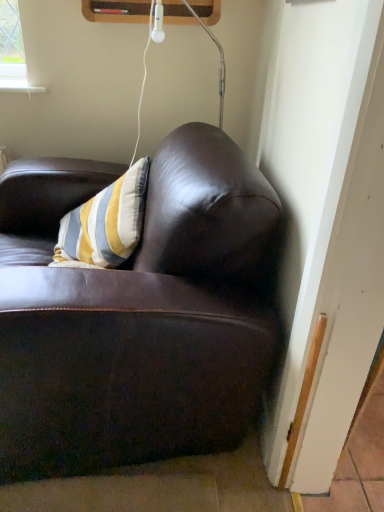
Question: From a real-world perspective, does shiny brown leather couch at upper right sit lower than matte white lamp at upper center?

Choices:
 (A) no
 (B) yes

Answer: (B)

Question: Does shiny brown leather couch at upper right have a greater height compared to matte white lamp at upper center?

Choices:
 (A) yes
 (B) no

Answer: (A)

Question: Would you consider shiny brown leather couch at upper right to be distant from matte white lamp at upper center?

Choices:
 (A) yes
 (B) no

Answer: (B)

Question: Are shiny brown leather couch at upper right and matte white lamp at upper center making contact?

Choices:
 (A) no
 (B) yes

Answer: (A)

Question: Is shiny brown leather couch at upper right positioned with its back to matte white lamp at upper center?

Choices:
 (A) no
 (B) yes

Answer: (A)

Question: Is shiny brown leather couch at upper right to the right of matte white lamp at upper center from the viewer's perspective?

Choices:
 (A) yes
 (B) no

Answer: (B)

Question: From a real-world perspective, is matte white lamp at upper center located beneath shiny brown leather couch at upper right?

Choices:
 (A) yes
 (B) no

Answer: (B)

Question: Is matte white lamp at upper center facing towards shiny brown leather couch at upper right?

Choices:
 (A) no
 (B) yes

Answer: (A)

Question: Is matte white lamp at upper center behind shiny brown leather couch at upper right?

Choices:
 (A) yes
 (B) no

Answer: (A)

Question: Is matte white lamp at upper center facing away from shiny brown leather couch at upper right?

Choices:
 (A) yes
 (B) no

Answer: (B)

Question: Considering the relative sizes of matte white lamp at upper center and shiny brown leather couch at upper right in the image provided, is matte white lamp at upper center smaller than shiny brown leather couch at upper right?

Choices:
 (A) yes
 (B) no

Answer: (A)

Question: Is matte white lamp at upper center not within shiny brown leather couch at upper right?

Choices:
 (A) yes
 (B) no

Answer: (B)

Question: From the image's perspective, is matte white lamp at upper center positioned above or below shiny brown leather couch at upper right?

Choices:
 (A) below
 (B) above

Answer: (B)